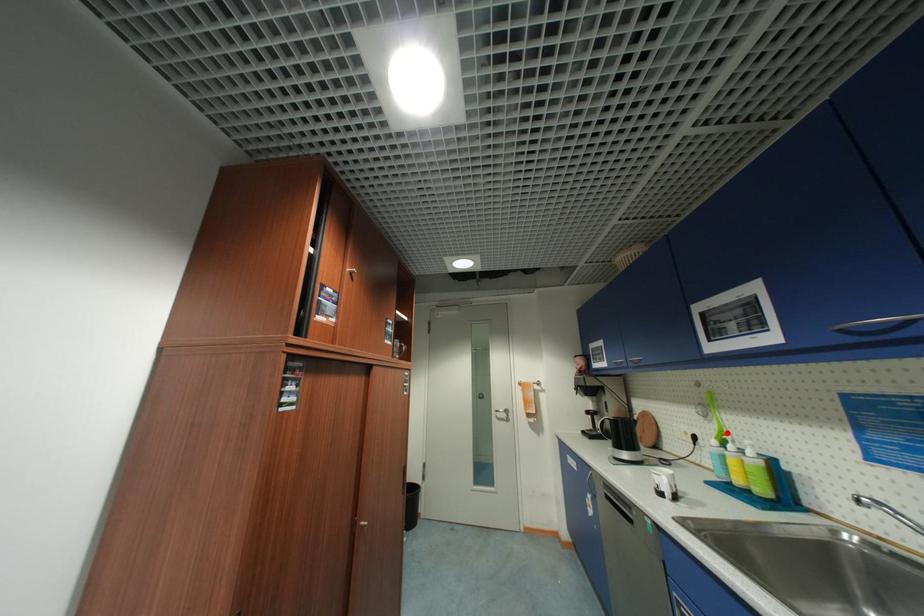
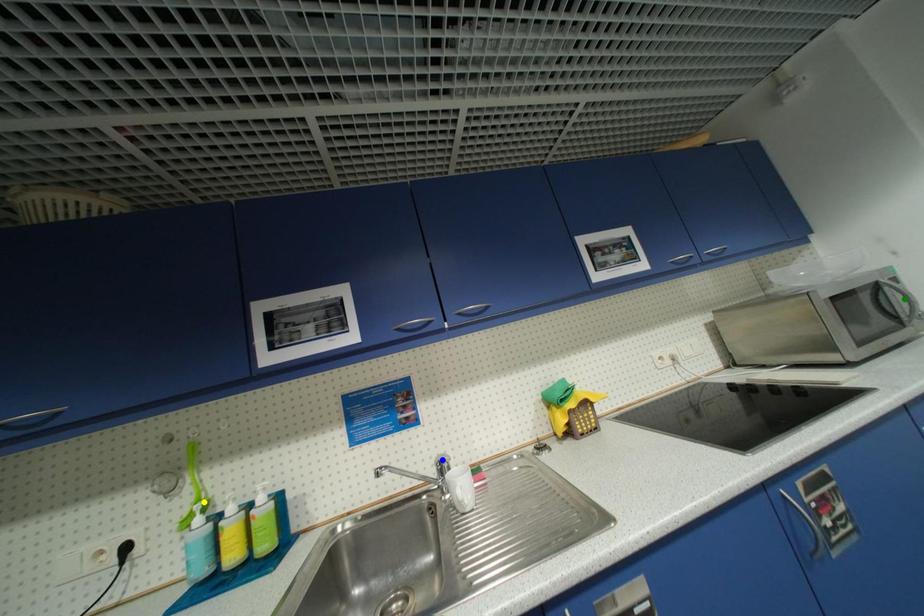
Question: I am providing you with two images of the same scene from different viewpoints. A red point is marked on the first image. You are given multiple points on the second image. Which spot in image 2 lines up with the point in image 1?

Choices:
 (A) blue point
 (B) green point
 (C) yellow point

Answer: (C)